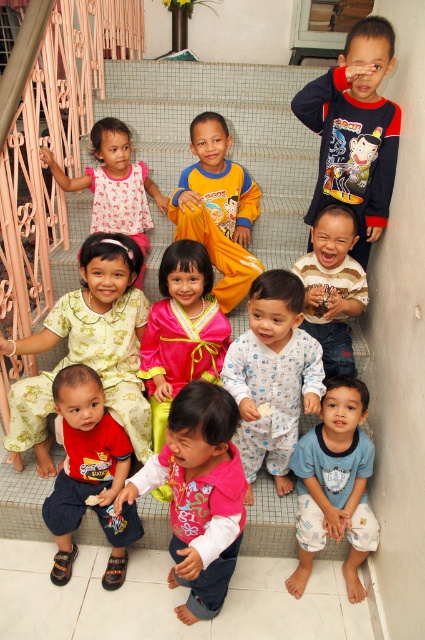
You are standing at the bottom of the staircase and want to hand a toy to the child wearing the dark blue cotton shirt at upper right. Based on their position, in which direction should you move to reach them?

The dark blue cotton shirt at upper right is located at point 0.205 on the x and 0.835 on the y axis, so you should move upwards and to the right to reach them.

You are standing at the bottom of the staircase and want to reach the top. There are two points marked on the staircase. One is at point [340,227] and the other is at point [99,154]. Which point should you step on first to ascend the staircase?

You should step on point [340,227] first because it is closer to the camera, meaning it is lower on the staircase and part of the first steps you would take when ascending.

Where is the striped jersey at center located in the image?

The striped jersey at center is located at point (333, 285) in the image.